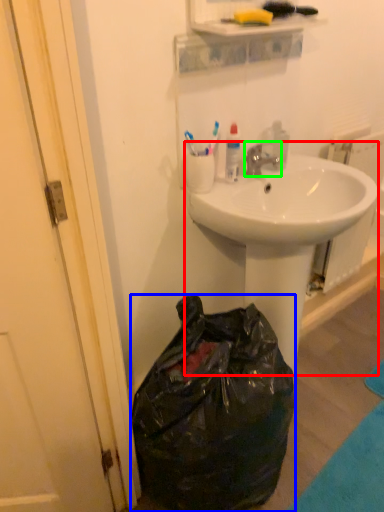
Question: Considering the real-world distances, which object is farthest from sink (highlighted by a red box)? trash bin/can (highlighted by a blue box) or faucet (highlighted by a green box)?

Choices:
 (A) trash bin/can
 (B) faucet

Answer: (A)